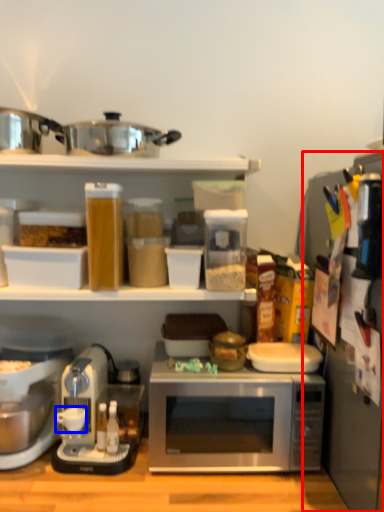
Question: Which point is closer to the camera, appliance (highlighted by a red box) or coffee cup (highlighted by a blue box)?

Choices:
 (A) appliance
 (B) coffee cup

Answer: (A)